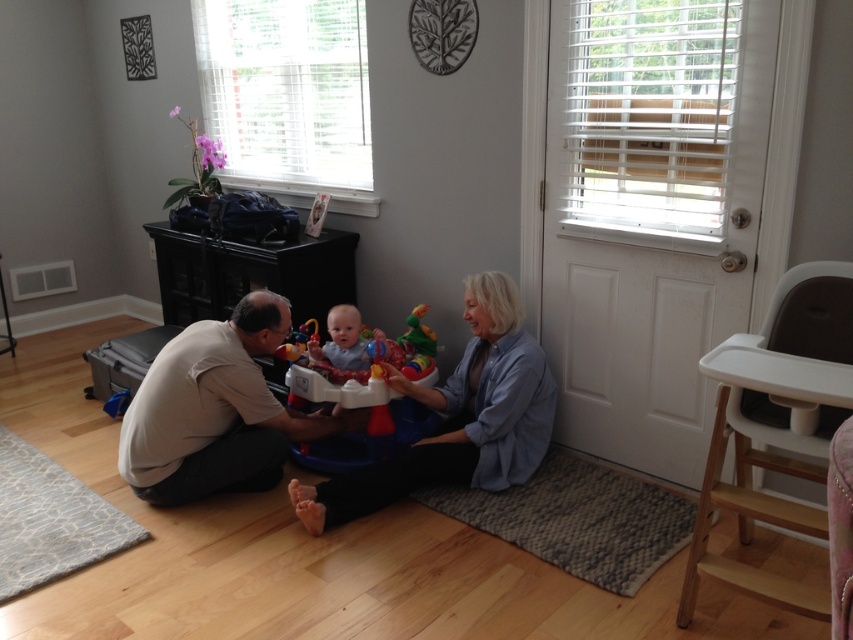
You are standing at the entrance of the room and want to reach the point marked as point (553, 396). Which direction should you move relative to point (421, 426)?

You should move towards the front direction relative to point (421, 426) because point (553, 396) is in front of it.